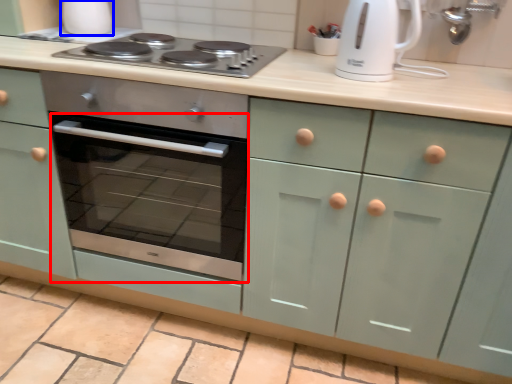
Question: Which object appears closest to the camera in this image, oven (highlighted by a red box) or appliance (highlighted by a blue box)?

Choices:
 (A) oven
 (B) appliance

Answer: (A)